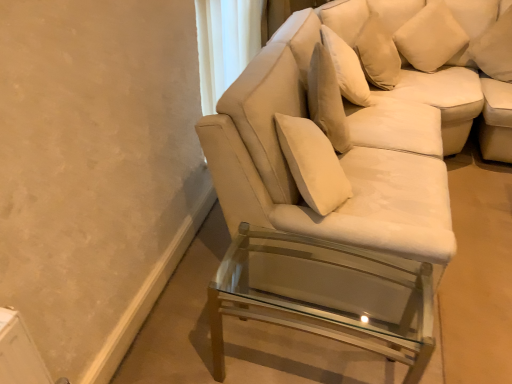
Question: Is white fabric couch at center positioned beyond the bounds of white soft cushion at upper right, arranged as the first pillow when viewed from the right?

Choices:
 (A) no
 (B) yes

Answer: (B)

Question: Is white fabric couch at center positioned behind white soft cushion at upper right, the 2th pillow viewed from the left?

Choices:
 (A) no
 (B) yes

Answer: (A)

Question: Can you confirm if white fabric couch at center is positioned to the right of white soft cushion at upper right, the 2th pillow viewed from the left?

Choices:
 (A) yes
 (B) no

Answer: (B)

Question: Is white fabric couch at center thinner than white soft cushion at upper right, the 2th pillow viewed from the left?

Choices:
 (A) no
 (B) yes

Answer: (A)

Question: Could white soft cushion at upper right, the 2th pillow viewed from the left, be considered to be inside white fabric couch at center?

Choices:
 (A) yes
 (B) no

Answer: (B)

Question: Considering the positions of white soft cushion at upper right, the 2th pillow viewed from the left, and white soft cushion at upper right, which ranks as the second pillow in right-to-left order, in the image, is white soft cushion at upper right, the 2th pillow viewed from the left, wider or thinner than white soft cushion at upper right, which ranks as the second pillow in right-to-left order,?

Choices:
 (A) wide
 (B) thin

Answer: (A)

Question: In terms of height, does white soft cushion at upper right, arranged as the first pillow when viewed from the right, look taller or shorter compared to white soft cushion at upper right, which ranks as the first pillow in left-to-right order?

Choices:
 (A) short
 (B) tall

Answer: (A)

Question: From a real-world perspective, is white soft cushion at upper right, arranged as the first pillow when viewed from the right, positioned above or below white soft cushion at upper right, which ranks as the first pillow in left-to-right order?

Choices:
 (A) below
 (B) above

Answer: (A)

Question: Is point (x=508, y=11) positioned closer to the camera than point (x=413, y=64)?

Choices:
 (A) farther
 (B) closer

Answer: (B)

Question: Is white soft cushion at upper right, arranged as the first pillow when viewed from the right, spatially inside clear glass table at lower right, or outside of it?

Choices:
 (A) outside
 (B) inside

Answer: (A)

Question: From the image's perspective, is white soft cushion at upper right, the 2th pillow viewed from the left, located above or below clear glass table at lower right?

Choices:
 (A) below
 (B) above

Answer: (B)

Question: Considering the positions of point (498, 72) and point (224, 281), is point (498, 72) closer or farther from the camera than point (224, 281)?

Choices:
 (A) closer
 (B) farther

Answer: (B)

Question: Would you say white soft cushion at upper right, arranged as the first pillow when viewed from the right, is to the left or to the right of clear glass table at lower right in the picture?

Choices:
 (A) left
 (B) right

Answer: (B)

Question: Based on their sizes in the image, would you say clear glass table at lower right is bigger or smaller than white soft cushion at upper right, the 2th pillow viewed from the left?

Choices:
 (A) small
 (B) big

Answer: (B)

Question: Visually, is clear glass table at lower right positioned to the left or to the right of white soft cushion at upper right, the 2th pillow viewed from the left?

Choices:
 (A) right
 (B) left

Answer: (B)